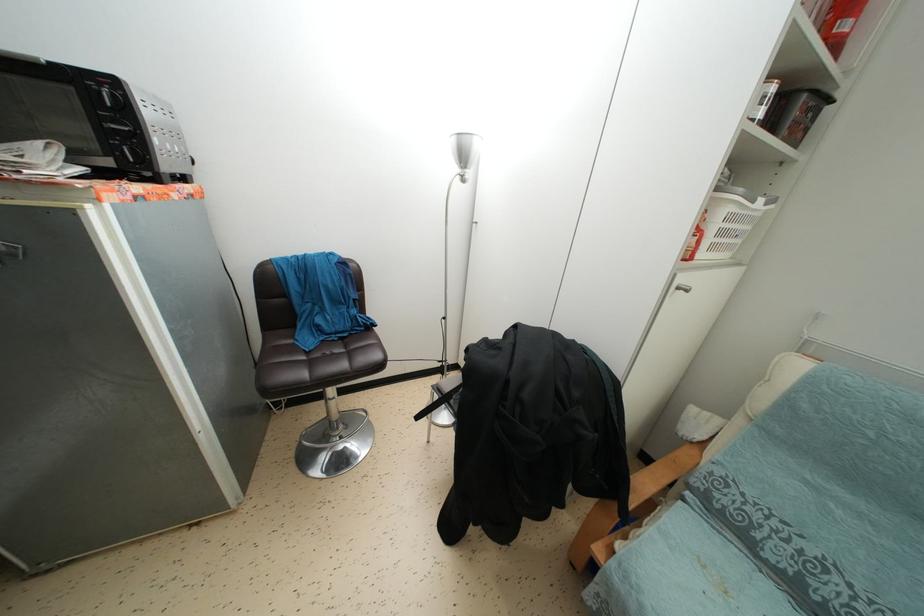
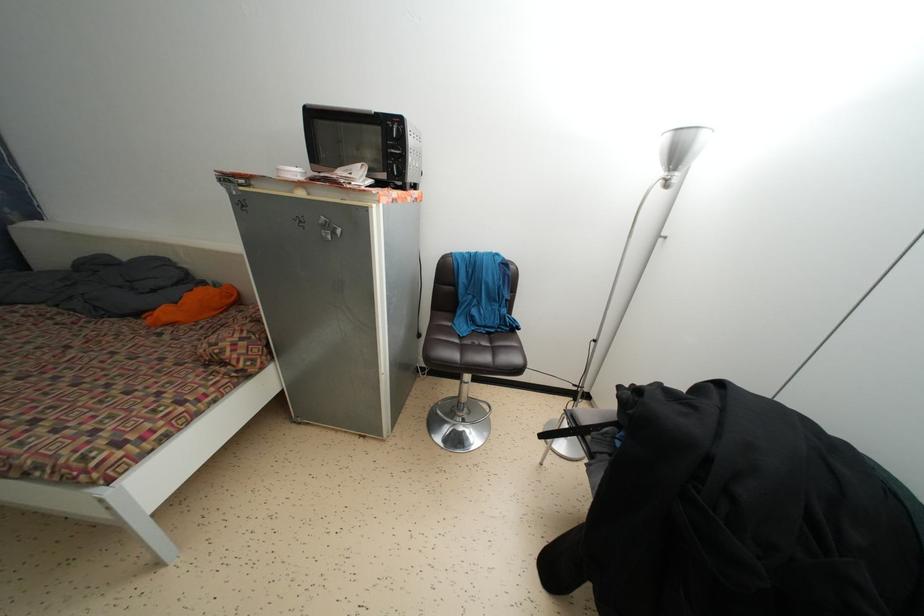
The point at (x=346, y=344) is marked in the first image. Where is the corresponding point in the second image?

(492, 339)